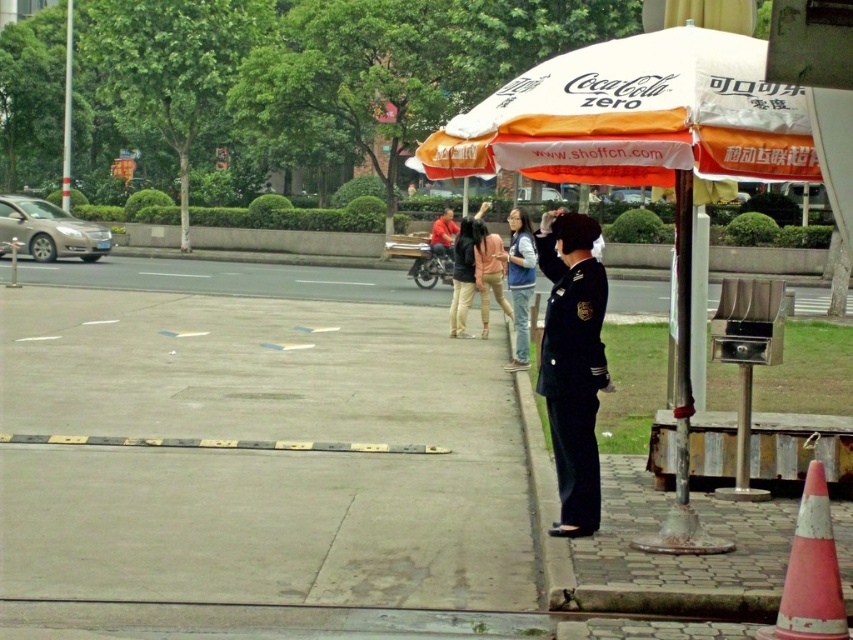
Is orange reflective cone at lower right closer to the viewer compared to denim jacket at center?

Yes, it is in front of denim jacket at center.

Which is more to the right, orange reflective cone at lower right or denim jacket at center?

Positioned to the right is orange reflective cone at lower right.

At what (x,y) coordinates should I click in order to perform the action: click on orange reflective cone at lower right. Please return your answer as a coordinate pair (x, y). The image size is (853, 640). Looking at the image, I should click on (810, 572).

Looking at this image, is white fabric umbrella at center shorter than metallic pole at right?

Indeed, white fabric umbrella at center has a lesser height compared to metallic pole at right.

Is point (746, 60) farther from camera compared to point (677, 467)?

No, (746, 60) is in front of (677, 467).

Is point (569, 147) more distant than point (680, 452)?

No, (569, 147) is in front of (680, 452).

What are the coordinates of `white fabric umbrella at center` in the screenshot? It's located at (637, 116).

Is point (462, 172) positioned in front of point (480, 285)?

Yes, it is in front of point (480, 285).

Can you confirm if white fabric umbrella at upper center is bigger than light pink fabric jacket at center?

No.

Identify the location of white fabric umbrella at upper center. (636, 116).